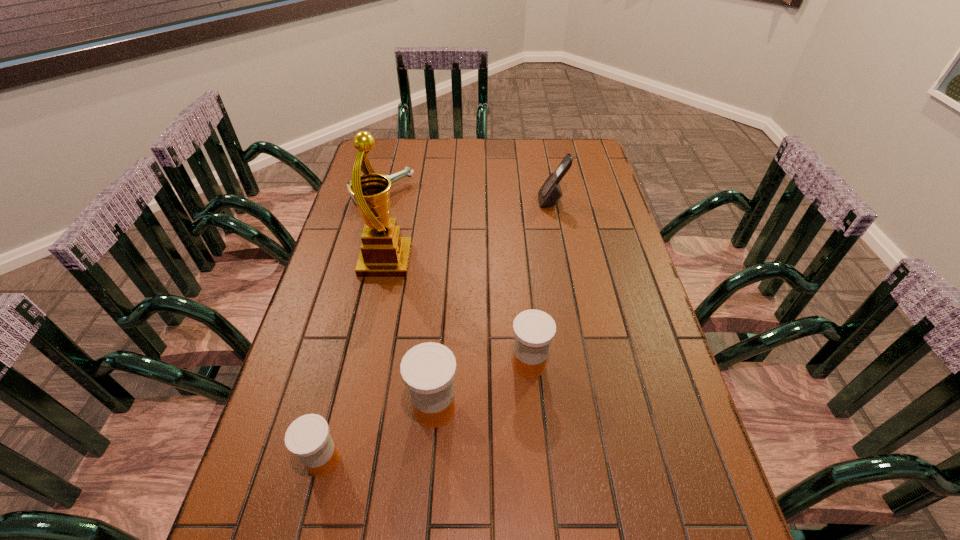
I want to click on vacant position located on the label of the second medicine from left to right, so click(x=383, y=408).

Where is `free space located on the label of the second medicine from left to right`? free space located on the label of the second medicine from left to right is located at coordinates (379, 408).

Where is `vacant space located on the label of the second medicine from left to right`? vacant space located on the label of the second medicine from left to right is located at coordinates (348, 408).

The width and height of the screenshot is (960, 540). In order to click on vacant space located 0.280m on the label of the second tallest medicine in this screenshot , I will do `click(396, 364)`.

Where is `vacant area situated 0.150m on the label of the second tallest medicine`? The image size is (960, 540). vacant area situated 0.150m on the label of the second tallest medicine is located at coordinates (448, 364).

I want to click on blank space located on the label of the second tallest medicine, so click(x=399, y=364).

Locate an element on the screen. blank space located on the front of the bottle is located at coordinates (364, 266).

Where is `free space located 0.230m on the front-facing side of the rightmost object`? Image resolution: width=960 pixels, height=540 pixels. free space located 0.230m on the front-facing side of the rightmost object is located at coordinates (472, 201).

This screenshot has height=540, width=960. I want to click on vacant region located on the front-facing side of the rightmost object, so click(x=475, y=201).

Identify the location of vacant space situated on the front-facing side of the rightmost object. (510, 201).